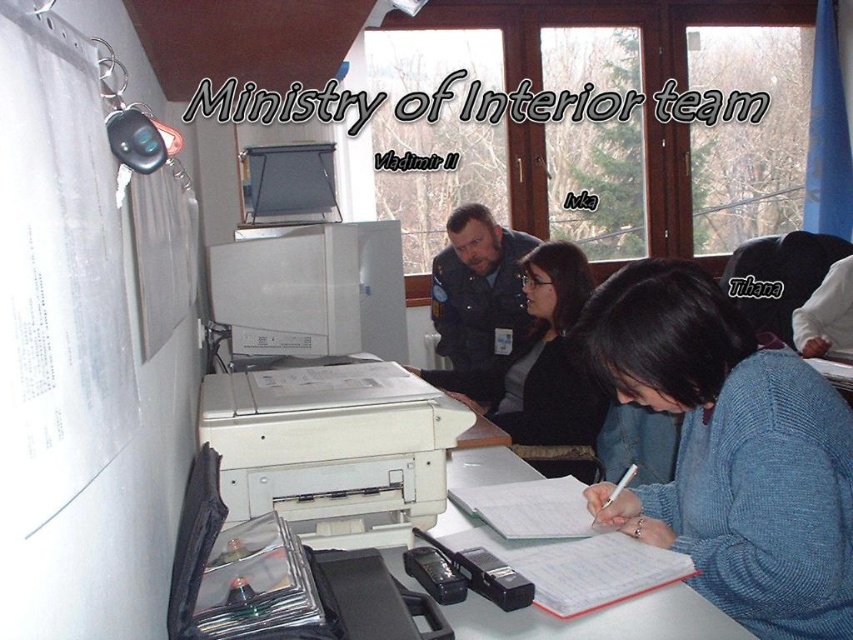
Question: Which of the following is the closest to the observer?

Choices:
 (A) (547, 280)
 (B) (820, 403)
 (C) (457, 429)

Answer: (B)

Question: Based on their relative distances, which object is nearer to the black plastic text at upper center?

Choices:
 (A) blue knitted sweater at lower right
 (B) dark blue uniform at center
 (C) matte black jacket at center
 (D) white plastic printer at center

Answer: (B)

Question: Based on their relative distances, which object is farther from the white plastic printer at center?

Choices:
 (A) matte black jacket at center
 (B) dark blue uniform at center
 (C) black plastic text at upper center

Answer: (B)

Question: Does white plastic printer at center have a lesser width compared to black plastic text at upper center?

Choices:
 (A) yes
 (B) no

Answer: (A)

Question: From the image, what is the correct spatial relationship of blue knitted sweater at lower right in relation to matte black jacket at center?

Choices:
 (A) below
 (B) above

Answer: (A)

Question: Considering the relative positions of black plastic text at upper center and matte black jacket at center in the image provided, where is black plastic text at upper center located with respect to matte black jacket at center?

Choices:
 (A) right
 (B) left

Answer: (A)